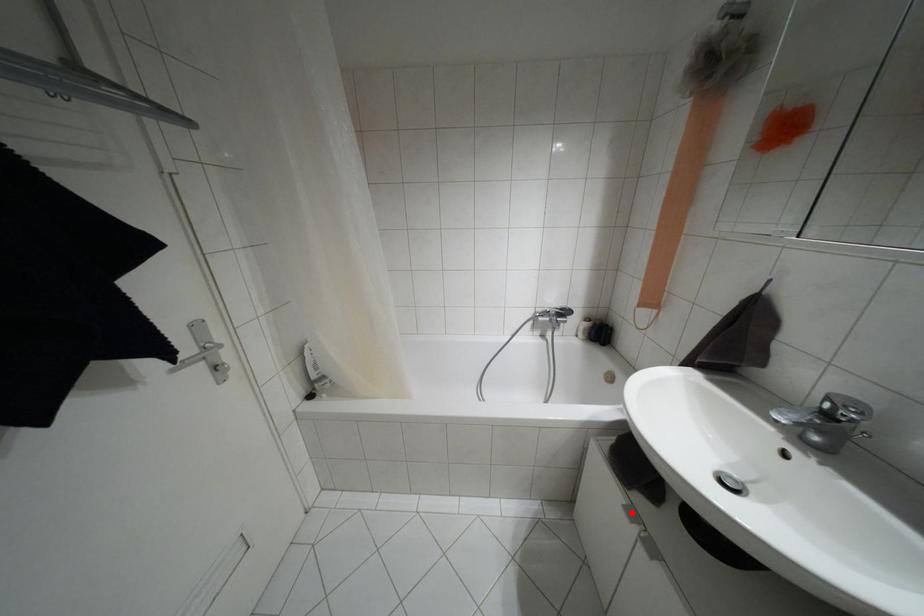
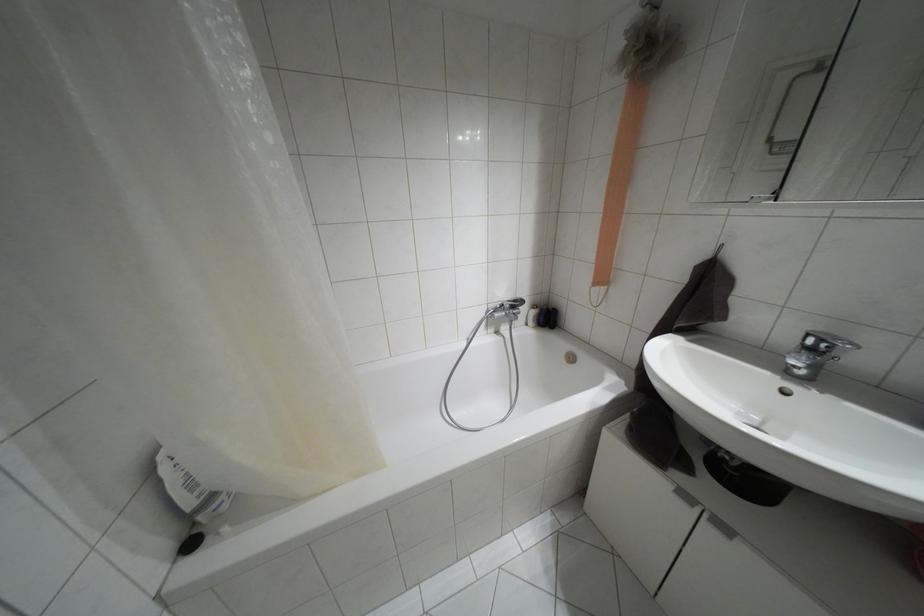
Locate, in the second image, the point that corresponds to the highlighted location in the first image.

(685, 496)